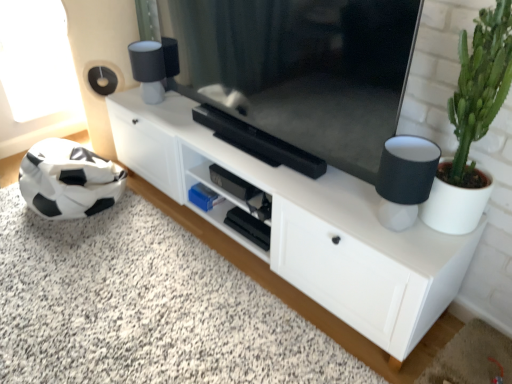
Locate an element on the screen. The image size is (512, 384). vacant area that is in front of black fabric lampshade at right is located at coordinates (414, 250).